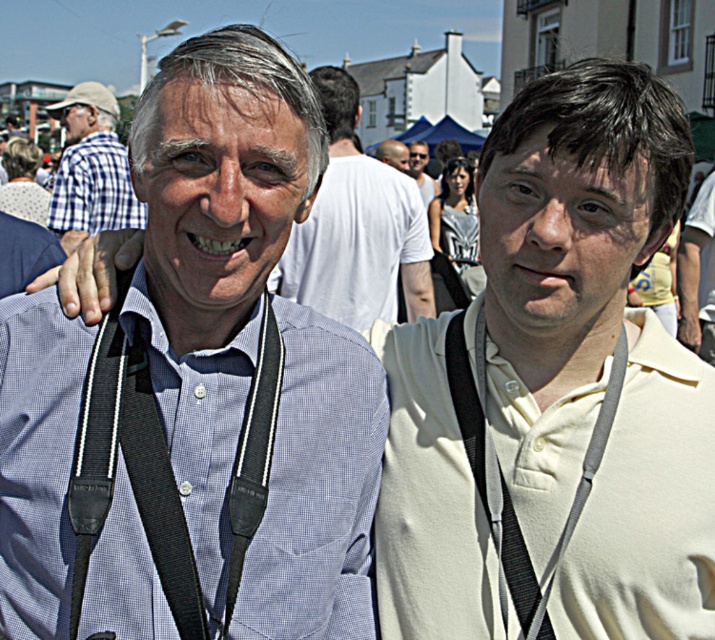
Based on the photo, you are a photographer at the event and need to quickly identify which object takes up more area in the photo. Which one is larger between the black fabric strap at right and the checkered fabric shirt at left?

The checkered fabric shirt at left occupies more area in the photo than the black fabric strap at right.

You are a photographer at the event and want to adjust your camera strap. You see the black fabric strap at right and the checkered fabric shirt at left. Which object is nearer to you?

The black fabric strap at right is closer to the viewer than the checkered fabric shirt at left.

You are a photographer at the event and want to adjust your camera strap so it hangs at the same length as the checkered fabric shirt at left. Currently, your black fabric strap at right is shorter. What should you do?

The black fabric strap at right is shorter than the checkered fabric shirt at left. To match the length, you need to lengthen the black fabric strap at right until it reaches the same length as the checkered fabric shirt at left.